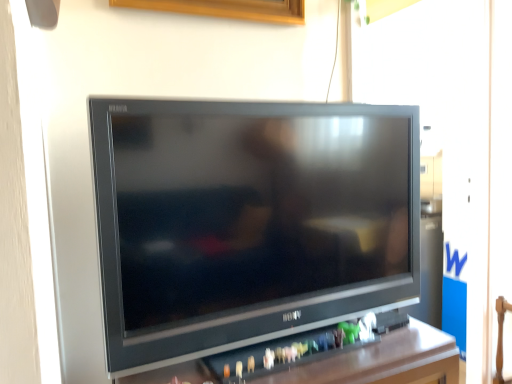
Question: Considering the relative sizes of black plastic tv at center and satin black television at center in the image provided, is black plastic tv at center thinner than satin black television at center?

Choices:
 (A) no
 (B) yes

Answer: (A)

Question: Is black plastic tv at center shorter than satin black television at center?

Choices:
 (A) no
 (B) yes

Answer: (B)

Question: Can you confirm if black plastic tv at center is wider than satin black television at center?

Choices:
 (A) no
 (B) yes

Answer: (B)

Question: Is black plastic tv at center beside satin black television at center?

Choices:
 (A) no
 (B) yes

Answer: (A)

Question: Considering the relative sizes of black plastic tv at center and satin black television at center in the image provided, is black plastic tv at center smaller than satin black television at center?

Choices:
 (A) yes
 (B) no

Answer: (B)

Question: Does black plastic tv at center have a greater height compared to satin black television at center?

Choices:
 (A) no
 (B) yes

Answer: (A)

Question: Would you consider satin black television at center to be distant from black plastic tv at center?

Choices:
 (A) no
 (B) yes

Answer: (A)

Question: Considering the relative positions of satin black television at center and black plastic tv at center in the image provided, is satin black television at center to the right of black plastic tv at center from the viewer's perspective?

Choices:
 (A) no
 (B) yes

Answer: (B)

Question: Is satin black television at center behind black plastic tv at center?

Choices:
 (A) yes
 (B) no

Answer: (A)

Question: Does satin black television at center have a greater height compared to black plastic tv at center?

Choices:
 (A) no
 (B) yes

Answer: (B)

Question: From a real-world perspective, is satin black television at center on top of black plastic tv at center?

Choices:
 (A) yes
 (B) no

Answer: (A)

Question: Considering the relative sizes of satin black television at center and black plastic tv at center in the image provided, is satin black television at center bigger than black plastic tv at center?

Choices:
 (A) no
 (B) yes

Answer: (A)

Question: Considering the positions of black plastic tv at center and satin black television at center in the image, is black plastic tv at center bigger or smaller than satin black television at center?

Choices:
 (A) big
 (B) small

Answer: (A)